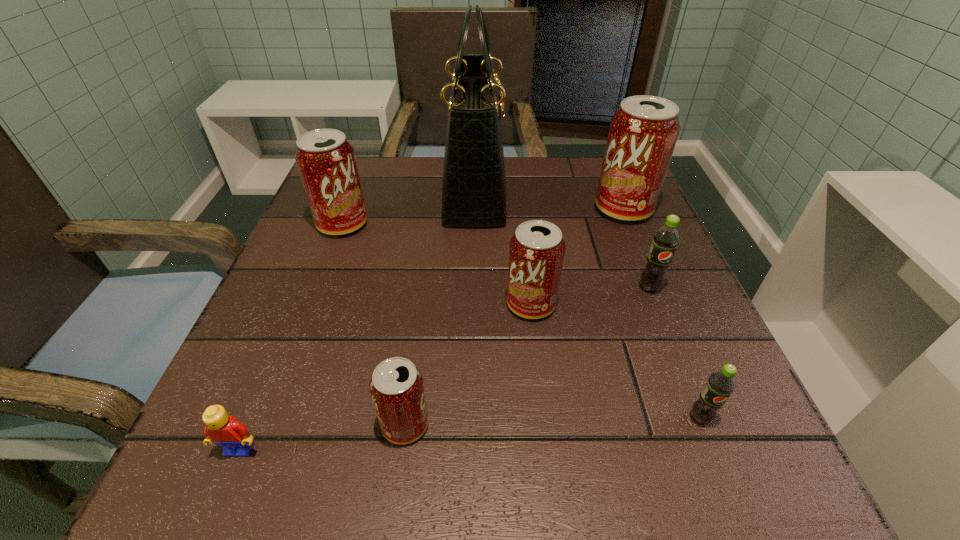
At what (x,y) coordinates should I click in order to perform the action: click on handbag present at the far edge. Please return your answer as a coordinate pair (x, y). Image resolution: width=960 pixels, height=540 pixels. Looking at the image, I should click on pyautogui.click(x=474, y=184).

You are a GUI agent. You are given a task and a screenshot of the screen. Output one action in this format:
    pyautogui.click(x=<x>, y=<y>)
    Task: Click on the soda can located in the far edge section of the desktop
    
    Given the screenshot: What is the action you would take?
    pyautogui.click(x=643, y=133)

The image size is (960, 540). In order to click on soda can located at the near edge in this screenshot , I will do `click(397, 390)`.

Identify the location of Lego that is at the near edge. (225, 431).

Where is `soda can that is positioned at the left edge`? soda can that is positioned at the left edge is located at coordinates (326, 161).

Locate an element on the screen. This screenshot has width=960, height=540. Lego located at the left edge is located at coordinates (225, 431).

This screenshot has height=540, width=960. Find the location of `object that is at the near left corner`. object that is at the near left corner is located at coordinates (225, 431).

The height and width of the screenshot is (540, 960). Find the location of `object that is positioned at the far right corner`. object that is positioned at the far right corner is located at coordinates (643, 133).

You are a GUI agent. You are given a task and a screenshot of the screen. Output one action in this format:
    pyautogui.click(x=<x>, y=<y>)
    Task: Click on the free space at the far edge
    The image size is (960, 540).
    Given the screenshot: What is the action you would take?
    pyautogui.click(x=440, y=167)

The height and width of the screenshot is (540, 960). I want to click on vacant point at the near edge, so click(x=404, y=485).